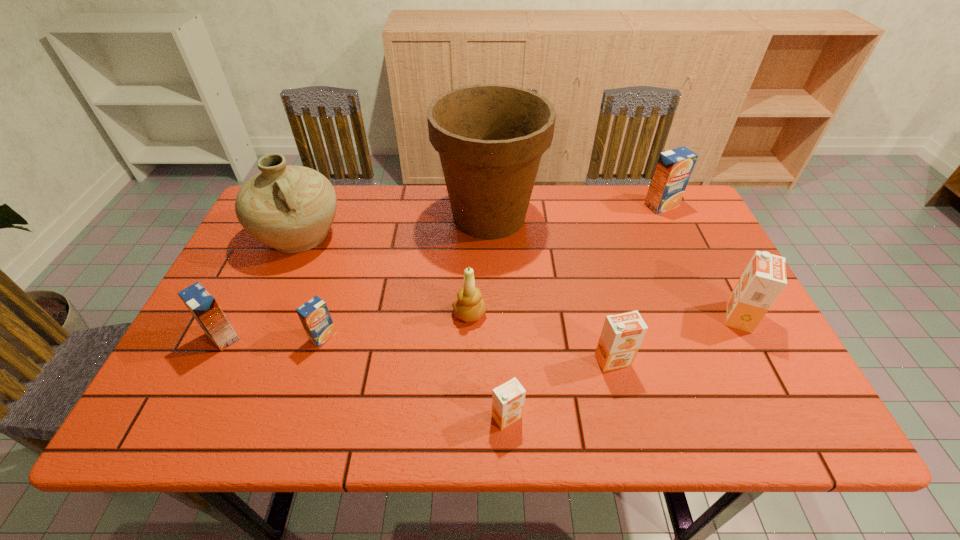
The height and width of the screenshot is (540, 960). Identify the location of free space between the candle_holder and the rightmost orange orange juice. (605, 315).

Where is `free space that is in between the candle_holder and the farthest orange orange juice`? free space that is in between the candle_holder and the farthest orange orange juice is located at coordinates (605, 315).

This screenshot has width=960, height=540. What are the coordinates of `free space between the tallest object and the second tallest object` in the screenshot? It's located at 395,226.

The width and height of the screenshot is (960, 540). In order to click on free space between the tallest object and the pottery in this screenshot , I will do `click(395, 226)`.

Where is `vacant space in between the second biggest blue orange_juice and the biggest orange orange juice`? Image resolution: width=960 pixels, height=540 pixels. vacant space in between the second biggest blue orange_juice and the biggest orange orange juice is located at coordinates (481, 327).

You are a GUI agent. You are given a task and a screenshot of the screen. Output one action in this format:
    pyautogui.click(x=<x>, y=<y>)
    Task: Click on the free space that is in between the second smallest blue orange_juice and the tallest object
    
    Given the screenshot: What is the action you would take?
    pyautogui.click(x=356, y=276)

Locate an element on the screen. vacant area between the farthest blue orange_juice and the tallest object is located at coordinates (575, 211).

Identify the location of object that is the sixth closest one to the candle_holder. This screenshot has width=960, height=540. (202, 305).

Choose which object is the fourth nearest neighbor to the second orange juice from left to right. Please provide its 2D coordinates. Your answer should be formatted as a tuple, i.e. [(x, y)], where the tuple contains the x and y coordinates of a point satisfying the conditions above.

[(490, 137)]

Identify which orange juice is the third closest to the candle_holder. Please provide its 2D coordinates. Your answer should be formatted as a tuple, i.e. [(x, y)], where the tuple contains the x and y coordinates of a point satisfying the conditions above.

[(314, 315)]